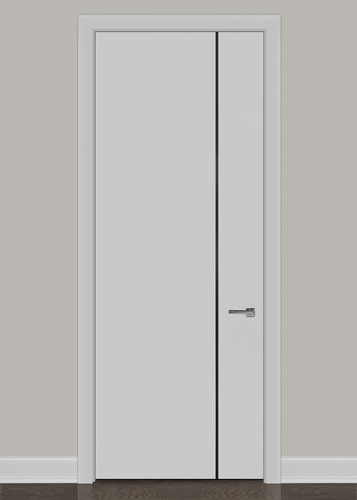
Locate an element on the screen. This screenshot has width=357, height=500. hardwood floor is located at coordinates (186, 492).